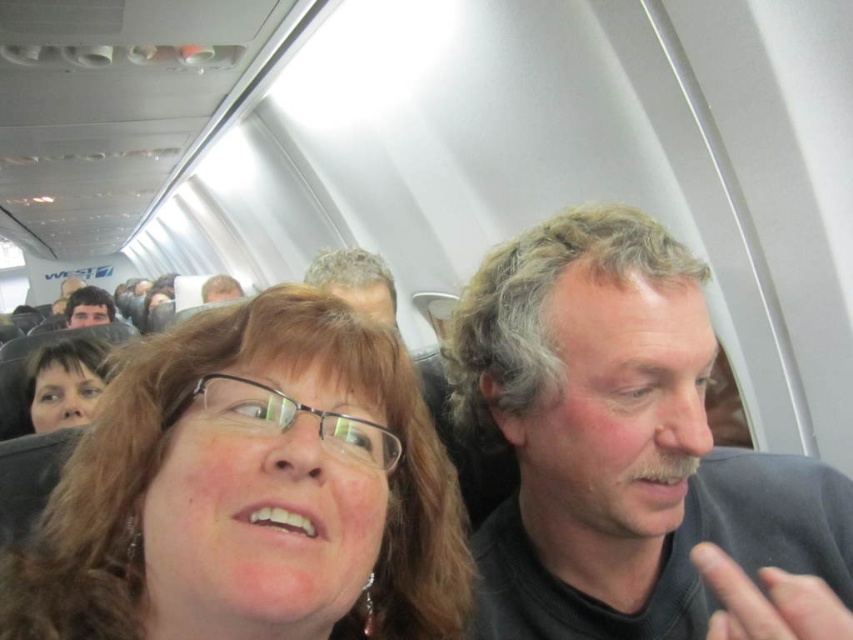
I want to click on gray hair at center, so click(x=618, y=440).

Which is in front, point (648, 426) or point (352, 275)?

Point (648, 426)

Is point (817, 522) positioned after point (352, 300)?

No, (817, 522) is in front of (352, 300).

At what (x,y) coordinates should I click in order to perform the action: click on gray hair at center. Please return your answer as a coordinate pair (x, y). Looking at the image, I should click on tap(618, 440).

What do you see at coordinates (250, 492) in the screenshot? I see `matte black hair at center` at bounding box center [250, 492].

Does matte black hair at center have a smaller size compared to gray hair at center?

Incorrect, matte black hair at center is not smaller in size than gray hair at center.

Which is behind, point (415, 512) or point (453, 337)?

Positioned behind is point (453, 337).

The width and height of the screenshot is (853, 640). Find the location of `matte black hair at center`. matte black hair at center is located at coordinates (250, 492).

Is point (543, 259) closer to viewer compared to point (103, 449)?

No.

Between matte black hair at center and matte black glasses at center, which one appears on the right side from the viewer's perspective?

From the viewer's perspective, matte black hair at center appears more on the right side.

Which is behind, point (596, 401) or point (436, 550)?

The point (436, 550) is more distant.

I want to click on matte black hair at center, so click(x=250, y=492).